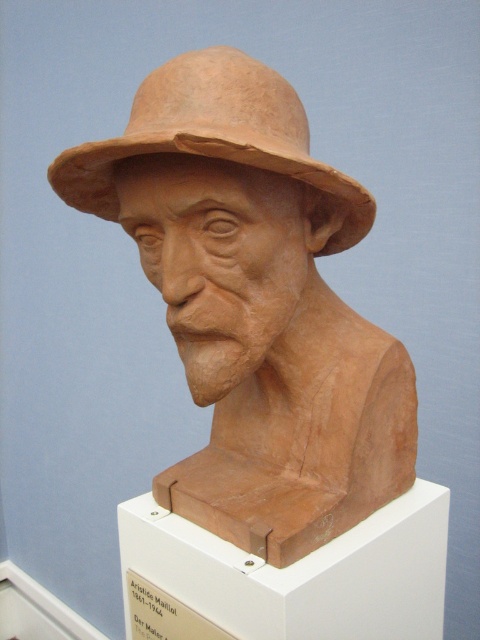
You are an art conservator tasked with transporting the matte clay bust at center and the matte clay cowboy hat at center. You have a storage box that can only accommodate items up to the size of the smaller object. Which object should you place in the box first to ensure safe transport?

The matte clay cowboy hat at center is smaller than the matte clay bust at center, so you should place the matte clay cowboy hat at center into the box first to ensure it is safely stored before placing the larger bust on top or separately.

You are an art curator arranging a display. You have a matte clay bust at center and a matte clay cowboy hat at center. According to the spatial arrangement, which object is positioned to the left?

The matte clay cowboy hat at center is positioned to the left of the matte clay bust at center.